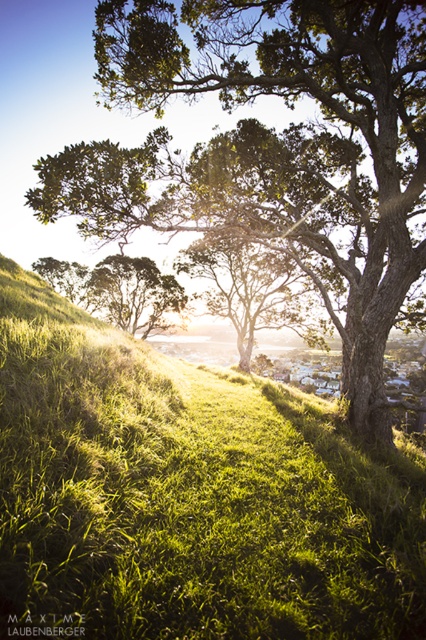
You are standing at the origin point in the scene. Where is the green grassy hillside at center located in terms of coordinates?

The green grassy hillside at center is located at coordinates point [187,497].

You are standing in the middle of the grassy hill and see the green leafy tree at center and the green matte tree at center. Which tree is closer to you?

The green leafy tree at center is closer to you because it is in front of the green matte tree at center.